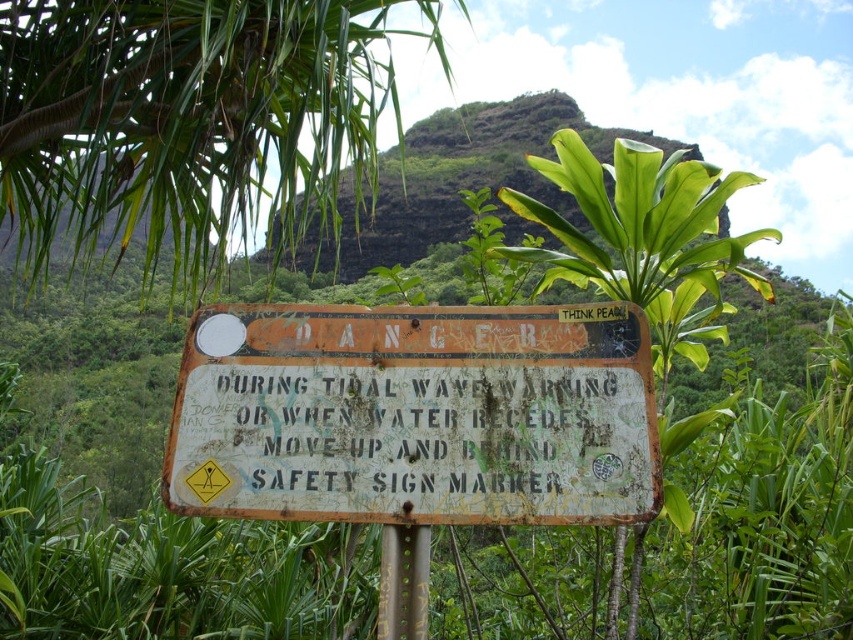
You are standing in front of the scene and see the rusty metal sign at center and the rusty metal pole at center. Which object is positioned to the left?

The rusty metal sign at center is to the left of the rusty metal pole at center.

You are a hiker trying to read the weathered signboard. There are two landmarks nearby, a green leafy plant at upper center and a green rock at center. Which landmark is taller?

The green leafy plant at upper center is much taller than the green rock at center.